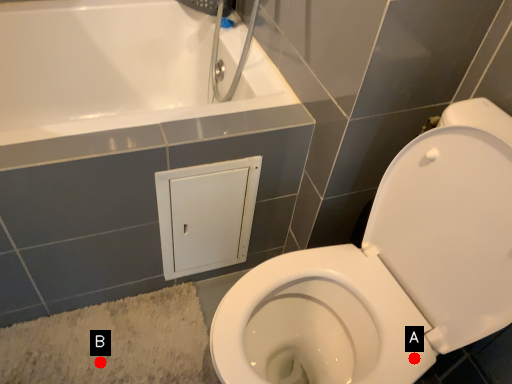
Question: Two points are circled on the image, labeled by A and B beside each circle. Which point is closer to the camera?

Choices:
 (A) A is closer
 (B) B is closer

Answer: (A)